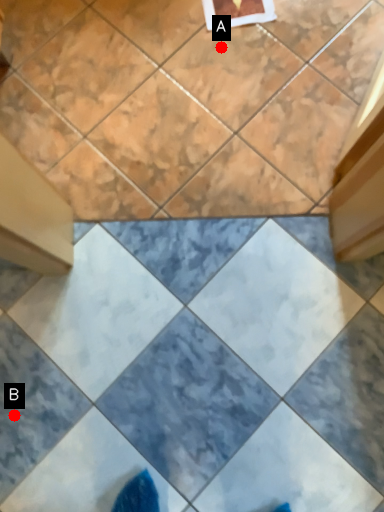
Question: Two points are circled on the image, labeled by A and B beside each circle. Which point appears farthest from the camera in this image?

Choices:
 (A) A is further
 (B) B is further

Answer: (A)